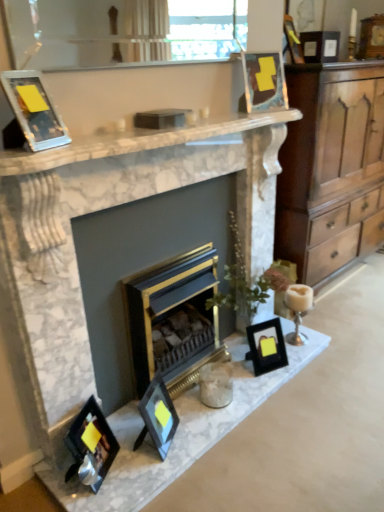
Question: In terms of height, does gold/black fireplace at center, the 1th fireplace from the right, look taller or shorter compared to clear glass window screen at upper center?

Choices:
 (A) short
 (B) tall

Answer: (B)

Question: Based on their positions, is gold/black fireplace at center, which appears as the 2th fireplace when viewed from the left, located to the left or right of clear glass window screen at upper center?

Choices:
 (A) left
 (B) right

Answer: (B)

Question: Based on their relative distances, which object is nearer to the wooden cabinet at right?

Choices:
 (A) metallic gold picture frame at upper center, marked as the 4th picture frame in a right-to-left arrangement
 (B) black glass frames at lower left
 (C) matte black picture frame at center, arranged as the fifth picture frame when viewed from the right
 (D) matte black picture frame at lower left, which is counted as the sixth picture frame, starting from the back
 (E) white ceramic candle holder at right

Answer: (A)

Question: Estimate the real-world distances between objects in this image. Which object is closer to the black matte picture frame at lower right, the fifth picture frame from the top?

Choices:
 (A) metallic gold picture frame at upper center, marked as the 4th picture frame in a right-to-left arrangement
 (B) marble fireplace mantel at upper center
 (C) matte glass picture frame at upper left, the 4th picture frame when ordered from top to bottom
 (D) wooden picture frame at upper right, arranged as the 7th picture frame when viewed from the front
 (E) marble fireplace at center, marked as the 2th fireplace in a right-to-left arrangement

Answer: (E)